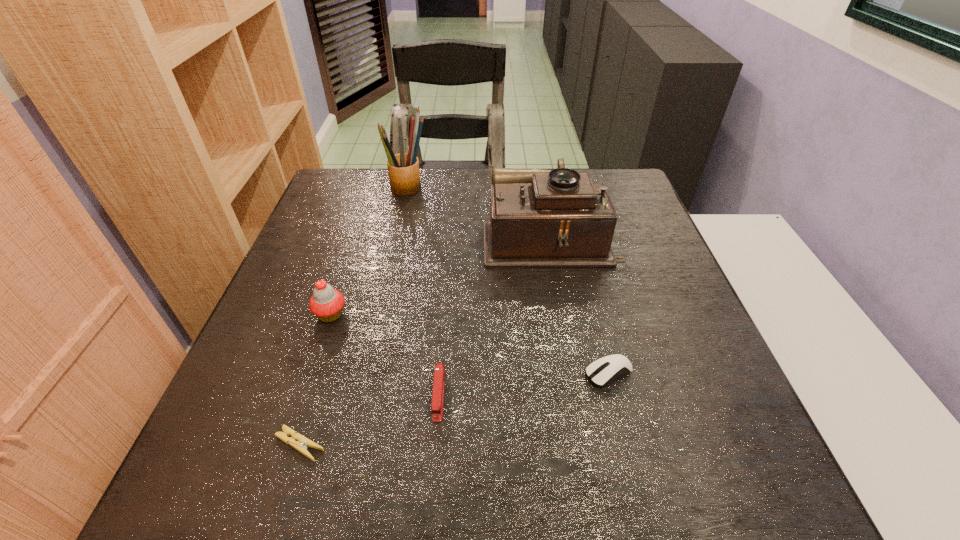
The width and height of the screenshot is (960, 540). What are the coordinates of `vacant space at the near right corner of the desktop` in the screenshot? It's located at (732, 477).

At what (x,y) coordinates should I click in order to perform the action: click on empty location between the nearest object and the farthest object. Please return your answer as a coordinate pair (x, y). This screenshot has height=540, width=960. Looking at the image, I should click on (354, 317).

Find the location of a particular element. This screenshot has height=540, width=960. free space between the second farthest object and the third shortest object is located at coordinates (494, 315).

Where is `vacant point located between the fourth nearest object and the clothespin`? This screenshot has height=540, width=960. vacant point located between the fourth nearest object and the clothespin is located at coordinates (x=316, y=380).

Locate an element on the screen. vacant point located between the second farthest object and the shortest object is located at coordinates (425, 340).

I want to click on vacant region between the pencil box and the fifth tallest object, so click(x=509, y=281).

You are a GUI agent. You are given a task and a screenshot of the screen. Output one action in this format:
    pyautogui.click(x=<x>, y=<y>)
    Task: Click on the vacant space that's between the third tallest object and the pencil box
    Image resolution: width=960 pixels, height=540 pixels.
    Given the screenshot: What is the action you would take?
    pyautogui.click(x=370, y=252)

Where is `free space between the clothespin and the mouse`? This screenshot has height=540, width=960. free space between the clothespin and the mouse is located at coordinates (454, 409).

The width and height of the screenshot is (960, 540). Identify the location of free space between the farthest object and the clothespin. (354, 317).

Find the location of a particular element. empty location between the farthest object and the nearest object is located at coordinates (354, 317).